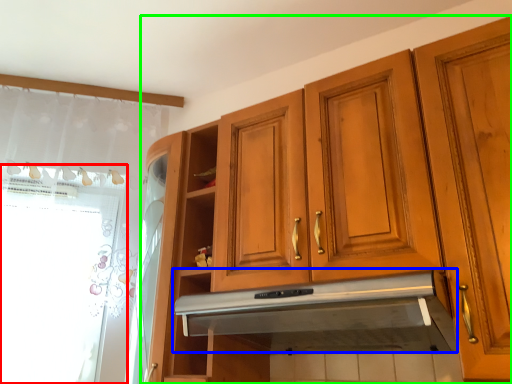
Question: Considering the real-world distances, which object is farthest from window screen (highlighted by a red box)? exhaust hood (highlighted by a blue box) or cabinetry (highlighted by a green box)?

Choices:
 (A) exhaust hood
 (B) cabinetry

Answer: (A)